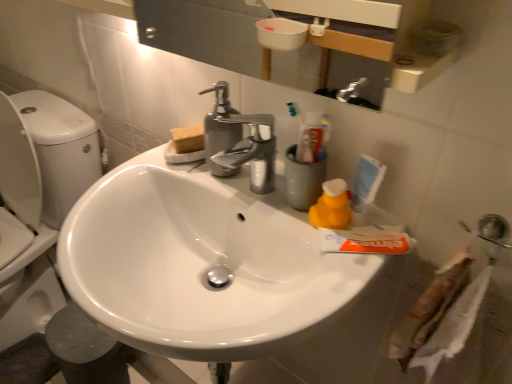
Question: Would you say yellow rubber duck at right is inside or outside metallic silver sink at lower right, acting as the 1th plumbing fixture starting from the right?

Choices:
 (A) outside
 (B) inside

Answer: (A)

Question: From a real-world perspective, is yellow rubber duck at right above or below metallic silver sink at lower right, the 2th plumbing fixture viewed from the left?

Choices:
 (A) below
 (B) above

Answer: (A)

Question: Which object is positioned closest to the satin nickel faucet at upper center, positioned as the 1th plumbing fixture in left-to-right order?

Choices:
 (A) chrome metallic faucet at center
 (B) metallic silver sink at lower right, the second plumbing fixture positioned from the top
 (C) yellow rubber duck at right
 (D) white matte toothpaste at center
 (E) white glossy sink at center

Answer: (A)

Question: Considering the real-world distances, which object is closest to the white glossy sink at center?

Choices:
 (A) yellow rubber duck at right
 (B) white matte toothpaste at center
 (C) metallic silver sink at lower right, acting as the 1th plumbing fixture starting from the right
 (D) satin nickel faucet at upper center, the first plumbing fixture when ordered from back to front
 (E) chrome metallic faucet at center

Answer: (E)